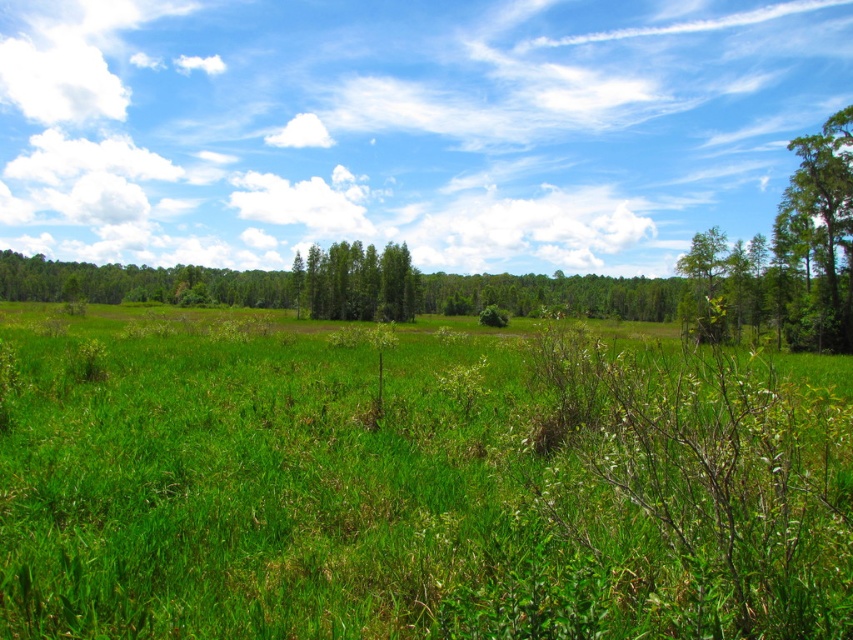
You are standing in the landscape and want to take a photo of the green leafy tree at right and the green leafy trees at center. Which tree or trees are closer to the camera?

The green leafy tree at right is positioned over the green leafy trees at center, so it appears closer to the camera.

You are planning to set up a picnic blanket in the green grassy field at center. Considering the green leafy tree at right, will the tree block the view of the field from your picnic spot?

The green grassy field at center is wider than the green leafy tree at right, so the tree will not block the entire view of the field from your picnic spot.